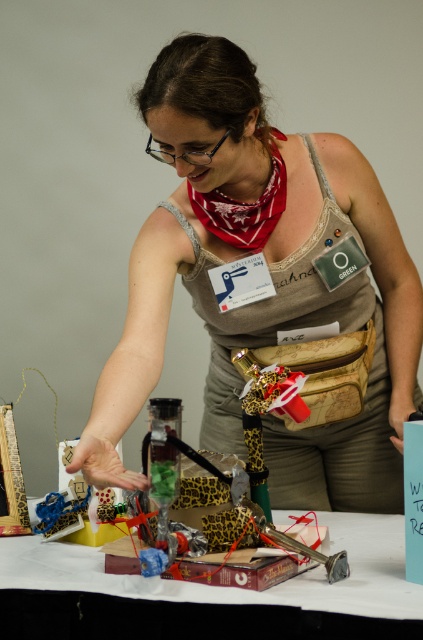
What are the coordinates of the matte gray tank top at center?

The matte gray tank top at center is located at point (271, 276).

You are a photographer positioned behind the table and want to capture both the matte gray tank top at center and the leopard print book at center in your shot. Which object will appear closer to the camera in the photo?

The matte gray tank top at center will appear closer to the camera because it is further to the viewer than the leopard print book at center.